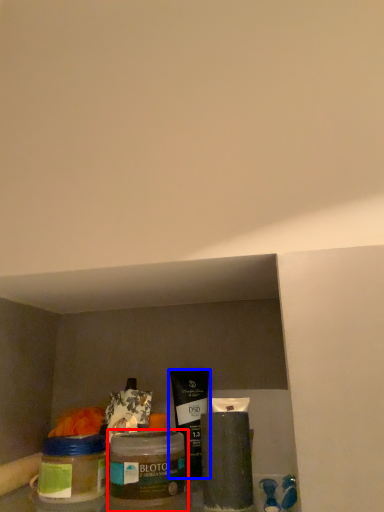
Question: Which object is closer to the camera taking this photo, glass jar (highlighted by a red box) or product (highlighted by a blue box)?

Choices:
 (A) glass jar
 (B) product

Answer: (A)